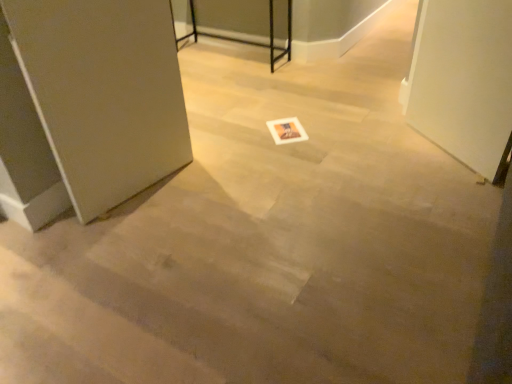
The image size is (512, 384). What are the coordinates of `vacant space situated on the left part of white paper postcard at center` in the screenshot? It's located at (252, 132).